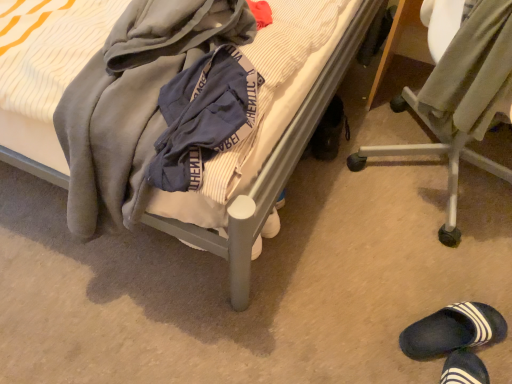
Question: Looking at their shapes, would you say soft gray blanket at center is wider or thinner than soft gray hoodie at center, the 2th clothing viewed from the right?

Choices:
 (A) wide
 (B) thin

Answer: (A)

Question: Looking at the image, does soft gray blanket at center seem bigger or smaller compared to soft gray hoodie at center, the 2th clothing viewed from the right?

Choices:
 (A) big
 (B) small

Answer: (A)

Question: Based on their relative distances, which object is farther from the soft gray blanket at center?

Choices:
 (A) soft gray hoodie at center, acting as the first clothing starting from the left
 (B) light olive-green fabric at right, which is the first clothing in right-to-left order
 (C) metallic silver chair at lower right
 (D) black rubber shoe at lower right, positioned as the second footwear in right-to-left order
 (E) dark blue rubber slipper at lower right, the 2th footwear from the left

Answer: (E)

Question: Considering the real-world distances, which object is farthest from the dark blue rubber slipper at lower right, marked as the 1th footwear in a right-to-left arrangement?

Choices:
 (A) light olive-green fabric at right, which is the second clothing in left-to-right order
 (B) soft gray blanket at center
 (C) soft gray hoodie at center, acting as the first clothing starting from the left
 (D) black rubber shoe at lower right, acting as the 2th footwear starting from the front
 (E) metallic silver chair at lower right

Answer: (C)